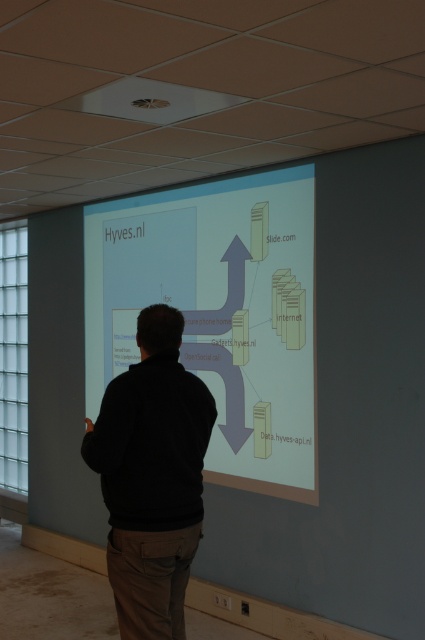
Question: Which object appears closest to the camera in this image?

Choices:
 (A) black matte jacket at center
 (B) matte white projector screen at center

Answer: (A)

Question: Can you confirm if matte white projector screen at center is bigger than black matte jacket at center?

Choices:
 (A) no
 (B) yes

Answer: (B)

Question: Is matte white projector screen at center to the right of black matte jacket at center from the viewer's perspective?

Choices:
 (A) no
 (B) yes

Answer: (B)

Question: Is matte white projector screen at center wider than black matte jacket at center?

Choices:
 (A) yes
 (B) no

Answer: (A)